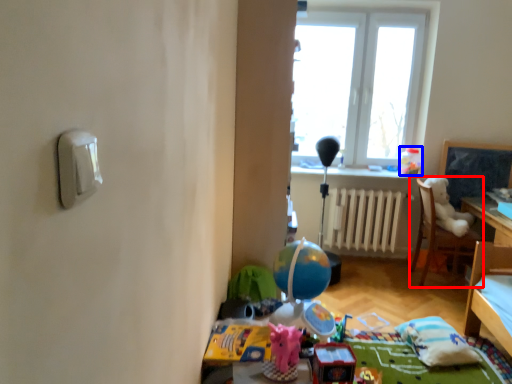
Question: Which object appears closest to the camera in this image, chair (highlighted by a red box) or toy (highlighted by a blue box)?

Choices:
 (A) chair
 (B) toy

Answer: (A)